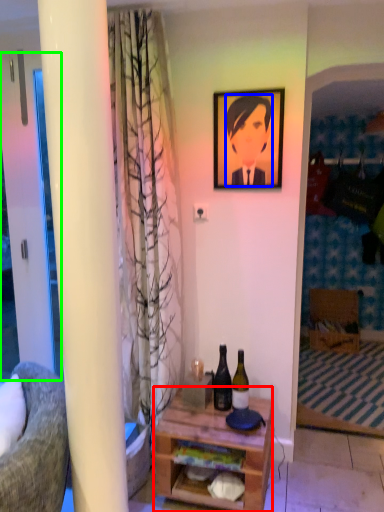
Question: Based on their relative distances, which object is farther from desk (highlighted by a red box)? Choose from person (highlighted by a blue box) and screen door (highlighted by a green box).

Choices:
 (A) person
 (B) screen door

Answer: (A)